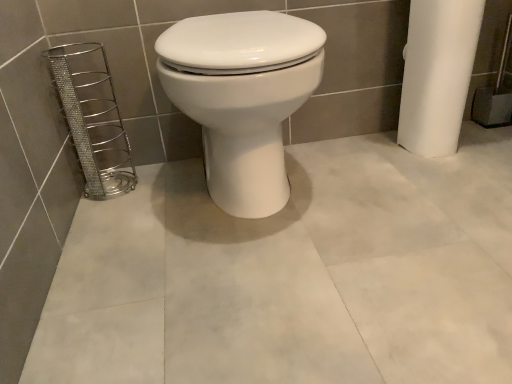
Where is `free space to the right of white glossy toilet at center`? Image resolution: width=512 pixels, height=384 pixels. free space to the right of white glossy toilet at center is located at coordinates (397, 194).